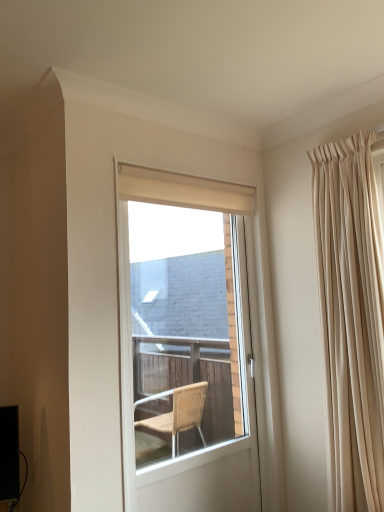
What do you see at coordinates (128, 257) in the screenshot? This screenshot has height=512, width=384. I see `white matte window at center` at bounding box center [128, 257].

This screenshot has width=384, height=512. Identify the location of white matte window at center. (128, 257).

Find the location of a particular element. Image resolution: width=384 pixels, height=512 pixels. white matte window at center is located at coordinates (128, 257).